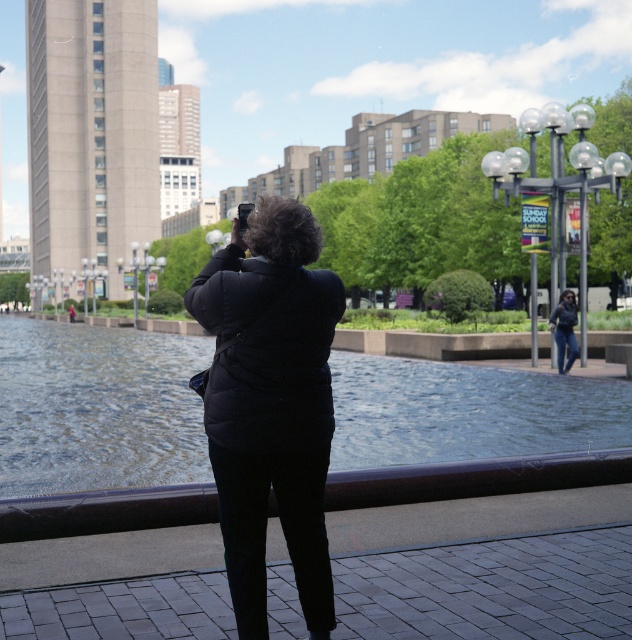
Question: Does blue glassy water at center come behind black matte jacket at center?

Choices:
 (A) yes
 (B) no

Answer: (A)

Question: Which object is the closest to the black matte jacket at center?

Choices:
 (A) blue glassy water at center
 (B) denim jacket at center

Answer: (A)

Question: Among these objects, which one is farthest from the camera?

Choices:
 (A) black matte jacket at center
 (B) denim jacket at center

Answer: (B)

Question: Is blue glassy water at center smaller than black matte jacket at center?

Choices:
 (A) yes
 (B) no

Answer: (B)

Question: Can you confirm if blue glassy water at center is positioned to the right of black matte jacket at center?

Choices:
 (A) no
 (B) yes

Answer: (A)

Question: Which object is farther from the camera taking this photo?

Choices:
 (A) black matte jacket at center
 (B) denim jacket at center
 (C) blue glassy water at center

Answer: (B)